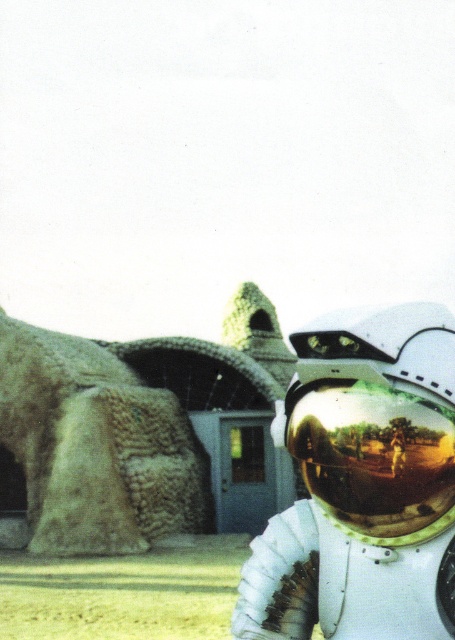
Question: Which object appears farthest from the camera in this image?

Choices:
 (A) shiny gold helmet at center
 (B) gold reflective helmet at center

Answer: (B)

Question: Which object is positioned closest to the shiny gold helmet at center?

Choices:
 (A) rustic stone sculpture at left
 (B) gold reflective helmet at center

Answer: (B)

Question: Is rustic stone sculpture at left thinner than gold reflective helmet at center?

Choices:
 (A) yes
 (B) no

Answer: (B)

Question: Is shiny gold helmet at center below rustic stone sculpture at left?

Choices:
 (A) no
 (B) yes

Answer: (A)

Question: Which object is positioned closest to the rustic stone sculpture at left?

Choices:
 (A) gold reflective helmet at center
 (B) shiny gold helmet at center

Answer: (B)

Question: Can you confirm if rustic stone sculpture at left is positioned to the left of gold reflective helmet at center?

Choices:
 (A) no
 (B) yes

Answer: (B)